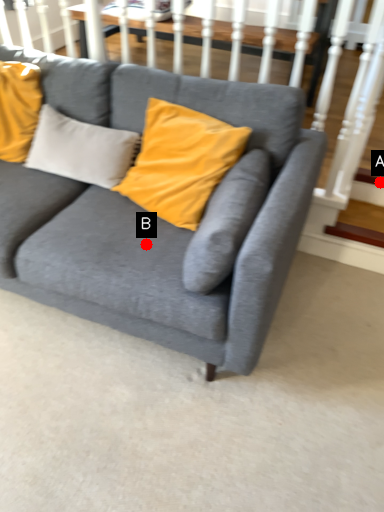
Question: Two points are circled on the image, labeled by A and B beside each circle. Which point is closer to the camera?

Choices:
 (A) A is closer
 (B) B is closer

Answer: (B)